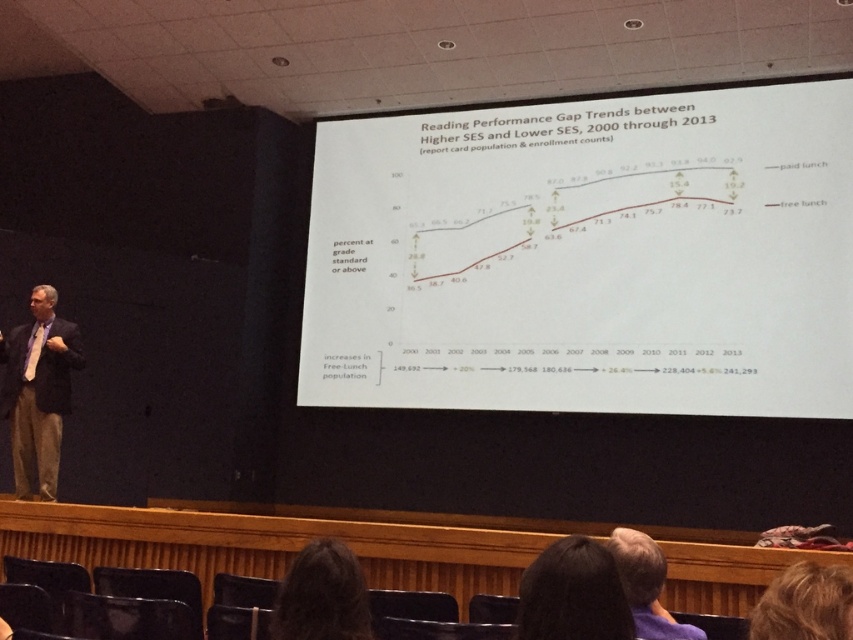
You are sitting in the front row of the lecture hall and want to ask a question to the presenter. You notice two people in the audience, one with dark hair at lower center and another with blonde hair at upper right. Which person is closer to you?

The dark hair at lower center is closer to you since it is further to the viewer than the blonde hair at upper right.

You are an attendee in the lecture hall and notice two items in the front of the room. One is the white paper at center and the other is the gray hair at upper center. Which item appears taller from your seated position?

The white paper at center appears taller than the gray hair at upper center because it has a greater height compared to it.